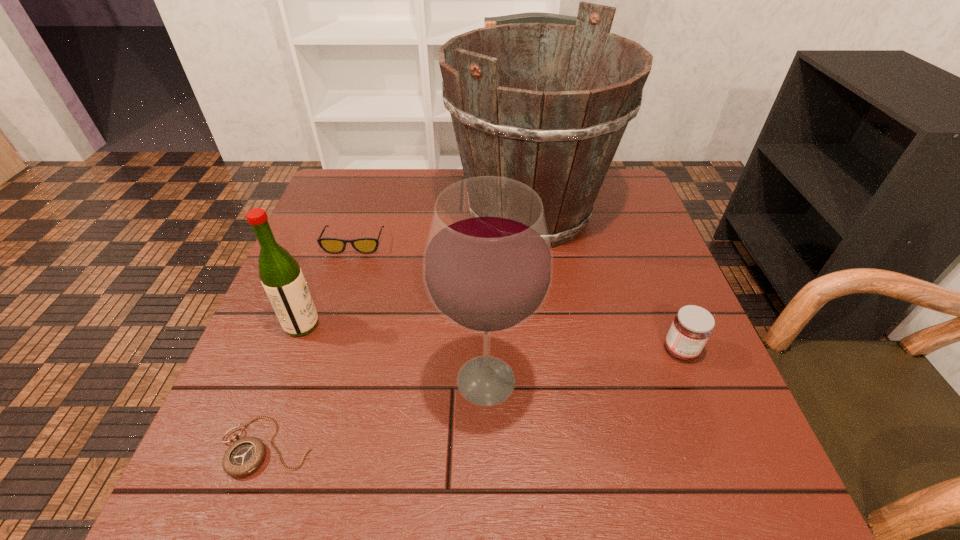
The width and height of the screenshot is (960, 540). What are the coordinates of `vacant space located 0.050m on the left of the jam` in the screenshot? It's located at (638, 350).

Where is `vacant region located on the front-facing side of the sunglasses`? vacant region located on the front-facing side of the sunglasses is located at coordinates (319, 356).

Identify the location of vacant region located on the back of the shortest object. (307, 333).

This screenshot has width=960, height=540. What are the coordinates of `object present at the far edge` in the screenshot? It's located at (560, 138).

Locate an element on the screen. object at the near edge is located at coordinates (245, 455).

Where is `liquor located in the left edge section of the desktop`? The width and height of the screenshot is (960, 540). liquor located in the left edge section of the desktop is located at coordinates (281, 276).

Where is `sunglasses situated at the left edge`? sunglasses situated at the left edge is located at coordinates (330, 245).

This screenshot has width=960, height=540. I want to click on pocket watch at the left edge, so click(245, 455).

This screenshot has width=960, height=540. Identify the location of bucket at the right edge. (560, 138).

Locate an element on the screen. The image size is (960, 540). jam that is at the right edge is located at coordinates (692, 326).